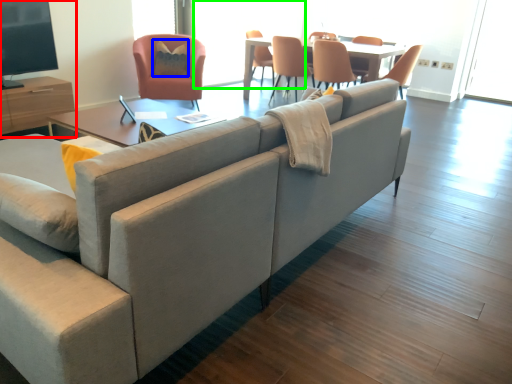
Question: Which is farther away from entertainment center (highlighted by a red box)? pillow (highlighted by a blue box) or window screen (highlighted by a green box)?

Choices:
 (A) pillow
 (B) window screen

Answer: (B)